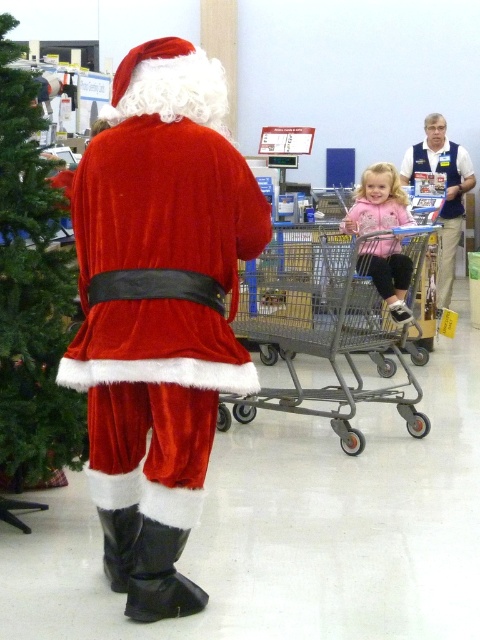
You are a customer in the store and want to place a gift under the green textured christmas tree at left. Which direction should you walk from your current position at point [32,296]?

The green textured christmas tree at left is located at point [32,296], so you are already at the correct position to place the gift under it.

You are a store employee who needs to rearrange the store layout. The velvet santa claus at center and the green textured christmas tree at left are currently 28.91 inches apart. If you want to place a 36 inch wide promotional banner between them, will there be enough space?

The velvet santa claus at center and the green textured christmas tree at left are 28.91 inches apart. Since the promotional banner is 36 inches wide, which is wider than the space between them, there is not enough space to place the banner between them.

In the scene shown: You are a customer in the store and want to take a photo of both the green textured christmas tree at left and the metallic gray shopping cart at right. Which object should you position closer to the camera to ensure both are in the frame?

To include both the green textured christmas tree at left and the metallic gray shopping cart at right in the photo, position the metallic gray shopping cart at right closer to the camera since it is already to the right of the tree and moving it closer would help frame both objects effectively.